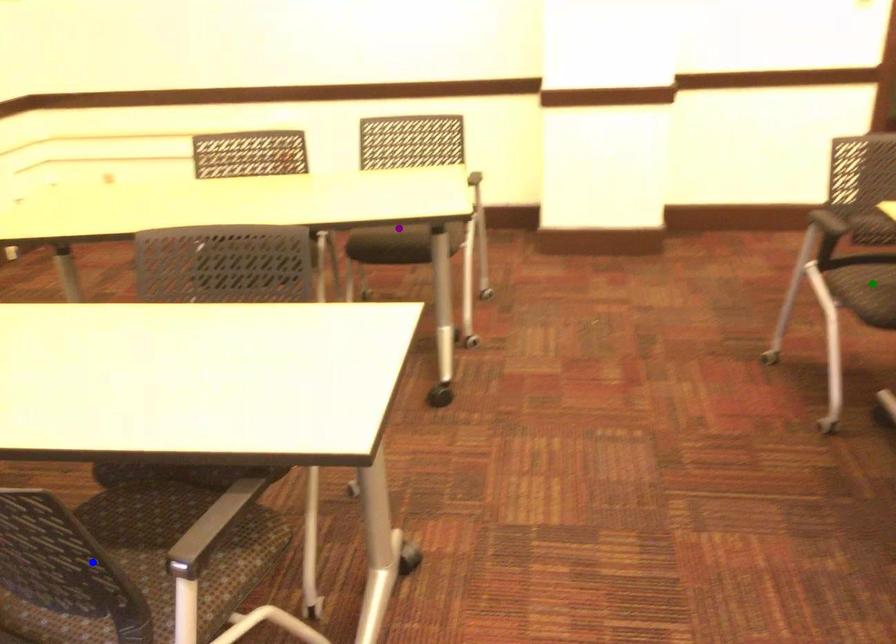
Based on the photo, order these from nearest to farthest:
purple point | green point | blue point

1. blue point
2. green point
3. purple point